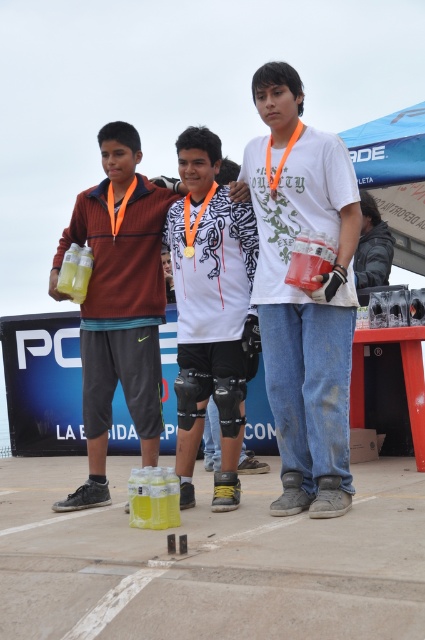
Question: Among these objects, which one is nearest to the camera?

Choices:
 (A) white matte t-shirt at center
 (B) white matte shirt at center
 (C) matte black glove at center
 (D) matte plastic bottles at center

Answer: (A)

Question: Which point is farther to the camera?

Choices:
 (A) matte black glove at center
 (B) white matte shirt at center
 (C) matte plastic bottles at center

Answer: (A)

Question: Which object appears farthest from the camera in this image?

Choices:
 (A) white matte shirt at center
 (B) matte black glove at center
 (C) white matte t-shirt at center

Answer: (B)

Question: Is matte plastic bottles at center wider than white matte shirt at center?

Choices:
 (A) no
 (B) yes

Answer: (B)

Question: Is white matte t-shirt at center further to the viewer compared to white matte shirt at center?

Choices:
 (A) no
 (B) yes

Answer: (A)

Question: Is matte plastic bottles at center bigger than white matte shirt at center?

Choices:
 (A) yes
 (B) no

Answer: (A)